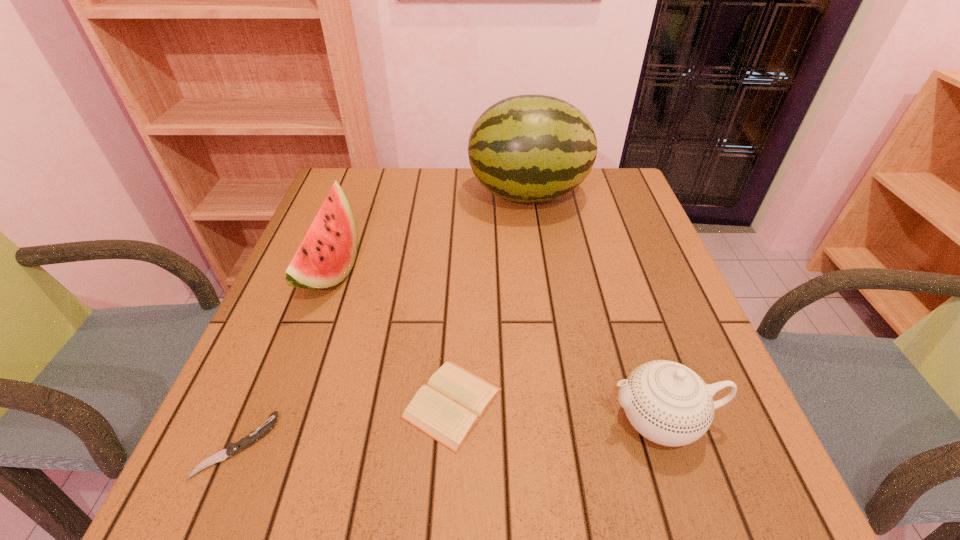
Locate an element on the screen. the right watermelon is located at coordinates [528, 148].

Identify the location of the farthest object. Image resolution: width=960 pixels, height=540 pixels. (528, 148).

Identify the location of the left watermelon. The image size is (960, 540). (325, 257).

Image resolution: width=960 pixels, height=540 pixels. In order to click on the second farthest object in this screenshot , I will do `click(325, 257)`.

The height and width of the screenshot is (540, 960). I want to click on the third shortest object, so click(x=668, y=403).

In order to click on diary in this screenshot , I will do `click(447, 409)`.

Image resolution: width=960 pixels, height=540 pixels. What are the coordinates of `pocketknife` in the screenshot? It's located at (232, 449).

This screenshot has width=960, height=540. What are the coordinates of `free location located 0.390m at the stem end of the tallest object` in the screenshot? It's located at (333, 194).

This screenshot has height=540, width=960. What are the coordinates of `vacant space located 0.360m at the stem end of the tallest object` in the screenshot? It's located at (344, 194).

Where is `vacant space positioned at the stem end of the tallest object`? The height and width of the screenshot is (540, 960). vacant space positioned at the stem end of the tallest object is located at coordinates (357, 194).